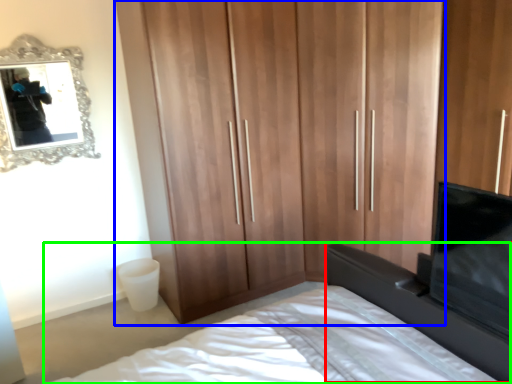
Question: Which object is positioned farthest from vanity (highlighted by a red box)? Select from cupboard (highlighted by a blue box) and bed (highlighted by a green box).

Choices:
 (A) cupboard
 (B) bed

Answer: (A)